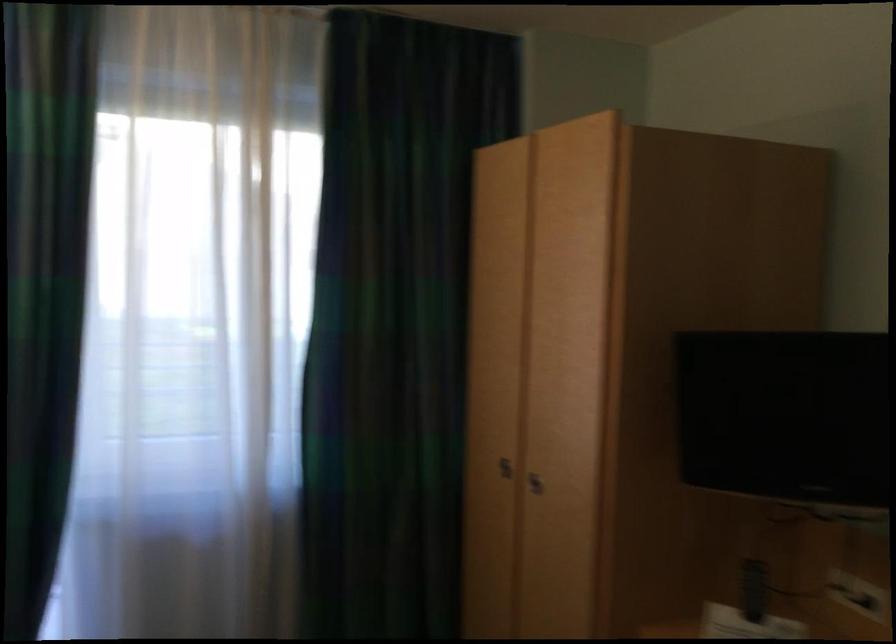
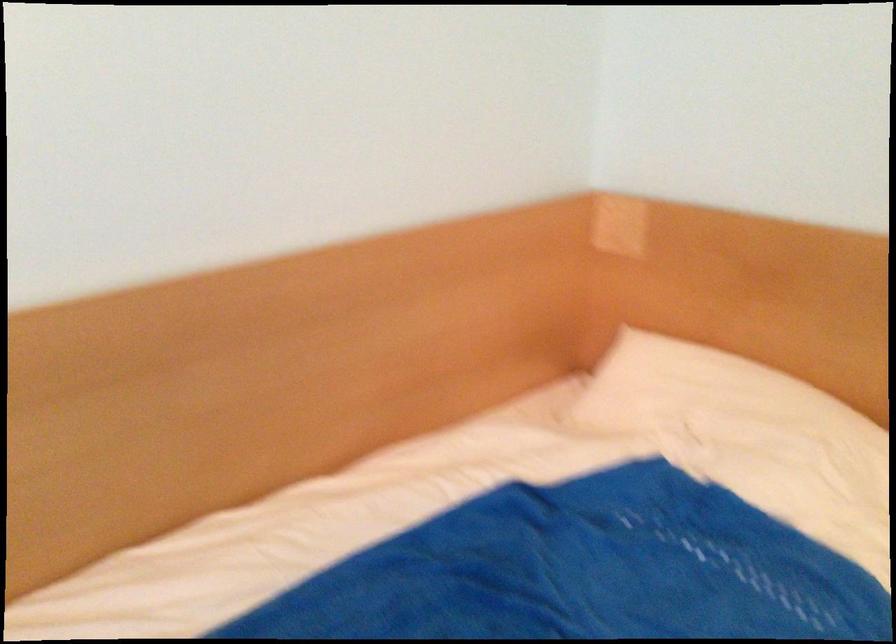
The first image is from the beginning of the video and the second image is from the end. How did the camera likely rotate when shooting the video?

The rotation direction of the camera is right-down.